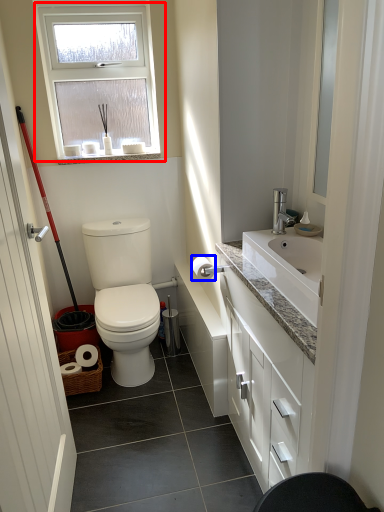
Question: Which of the following is the closest to the observer, window (highlighted by a red box) or toilet paper (highlighted by a blue box)?

Choices:
 (A) window
 (B) toilet paper

Answer: (B)